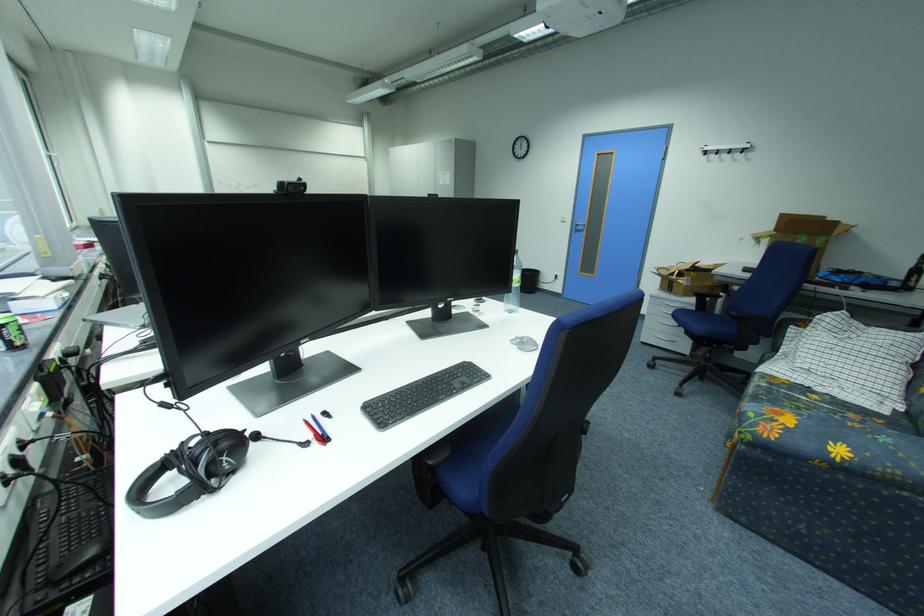
Image resolution: width=924 pixels, height=616 pixels. I want to click on black headphones, so click(189, 471).